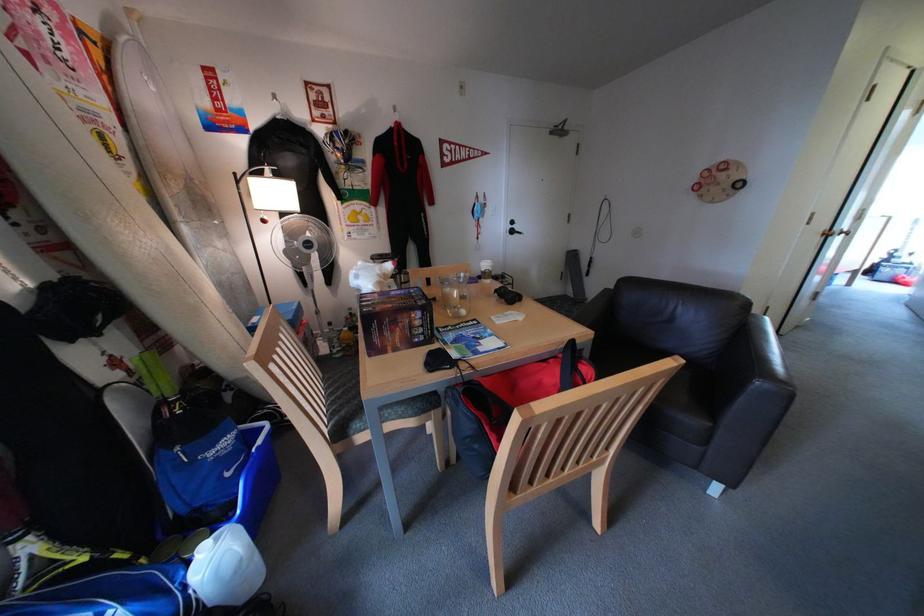
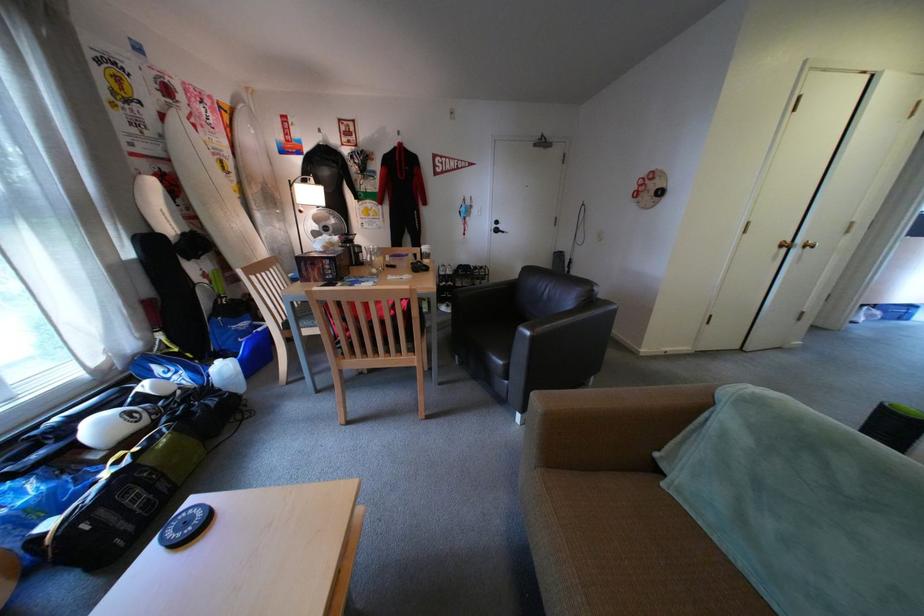
Find the pixel in the second image that matches [419,282] in the first image.

(373, 253)